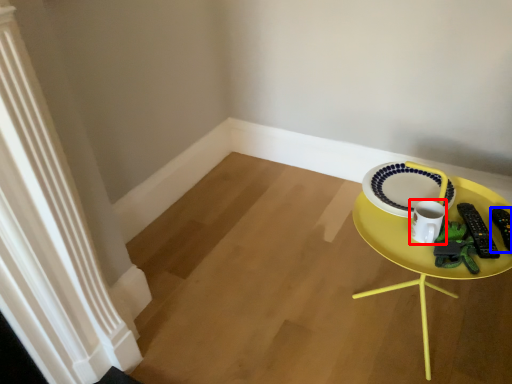
Question: Among these objects, which one is nearest to the camera, coffee cup (highlighted by a red box) or remote control (highlighted by a blue box)?

Choices:
 (A) coffee cup
 (B) remote control

Answer: (A)